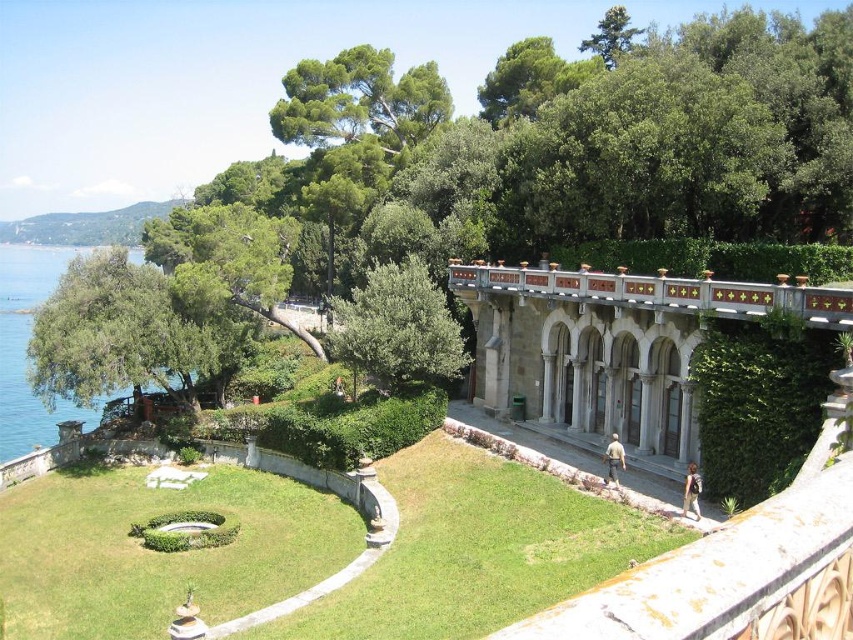
Question: Based on their relative distances, which object is farther from the green water at left?

Choices:
 (A) green leafy hedge at center-right
 (B) green ivy hedge at upper center
 (C) green leafy tree at upper left
 (D) green leafy tree at center

Answer: (A)

Question: Which point is farther to the camera?

Choices:
 (A) white stone archway at center
 (B) green ivy hedge at upper center
 (C) green leafy tree at center
 (D) green water at left

Answer: (D)

Question: Is green leafy tree at upper left positioned before green leafy hedge at center-right?

Choices:
 (A) no
 (B) yes

Answer: (B)

Question: Can you confirm if green water at left is bigger than green ivy hedge at upper center?

Choices:
 (A) no
 (B) yes

Answer: (B)

Question: Considering the real-world distances, which object is farthest from the green water at left?

Choices:
 (A) green ivy hedge at upper center
 (B) green leafy hedge at center-right
 (C) green leafy tree at upper left
 (D) white stone archway at center

Answer: (B)

Question: In this image, where is green leafy tree at center located relative to green water at left?

Choices:
 (A) right
 (B) left

Answer: (A)